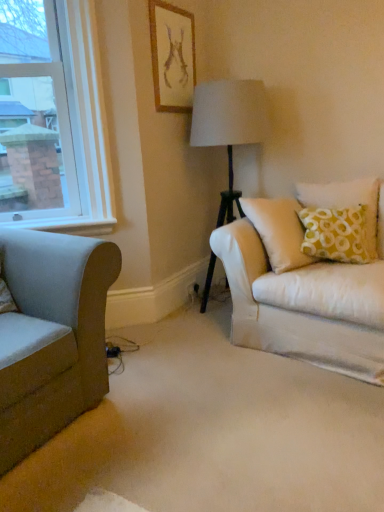
The width and height of the screenshot is (384, 512). What do you see at coordinates (213, 431) in the screenshot? I see `beige fabric carpet at center` at bounding box center [213, 431].

Find the location of `beige fabric carpet at center`. beige fabric carpet at center is located at coordinates (213, 431).

What is the approximate width of velvet green couch at left?

velvet green couch at left is 99.92 centimeters in width.

At what (x,y) coordinates should I click in order to perform the action: click on velvet green couch at left. Please return your answer as a coordinate pair (x, y). This screenshot has width=384, height=512. Looking at the image, I should click on (51, 335).

What do you see at coordinates (52, 119) in the screenshot?
I see `white glass window at upper left` at bounding box center [52, 119].

Measure the distance between white glass window at upper left and camera.

They are 2.25 meters apart.

This screenshot has height=512, width=384. Describe the element at coordinates (172, 57) in the screenshot. I see `matte gold picture frame at upper center` at that location.

This screenshot has width=384, height=512. Describe the element at coordinates (348, 203) in the screenshot. I see `yellow printed fabric pillow at right` at that location.

You are a GUI agent. You are given a task and a screenshot of the screen. Output one action in this format:
    pyautogui.click(x=<x>, y=<y>)
    Task: Click on the beige fabric carpet at center
    The image size is (384, 512).
    Given the screenshot: What is the action you would take?
    pyautogui.click(x=213, y=431)

Where is `window above the yellow printed fabric pillow at right (from the image's perspective)`? This screenshot has height=512, width=384. window above the yellow printed fabric pillow at right (from the image's perspective) is located at coordinates (52, 119).

In terms of height, does yellow printed fabric pillow at right look taller or shorter compared to white glass window at upper left?

Considering their sizes, yellow printed fabric pillow at right has less height than white glass window at upper left.

From a real-world perspective, does yellow printed fabric pillow at right stand above white glass window at upper left?

No, from a real-world perspective, yellow printed fabric pillow at right is not over white glass window at upper left

Is yellow printed fabric pillow at right smaller than white glass window at upper left?

Indeed, yellow printed fabric pillow at right has a smaller size compared to white glass window at upper left.

Does yellow printed fabric pillow at right have a greater height compared to velvet green couch at left?

In fact, yellow printed fabric pillow at right may be shorter than velvet green couch at left.

Based on the photo, is yellow printed fabric pillow at right aimed at velvet green couch at left?

No, yellow printed fabric pillow at right is not facing towards velvet green couch at left.

Does point (369, 249) appear closer or farther from the camera than point (74, 314)?

Point (369, 249) is farther from the camera than point (74, 314).

Does yellow printed fabric pillow at right touch velvet green couch at left?

No, yellow printed fabric pillow at right is not next to velvet green couch at left.

Considering the sizes of objects white glass window at upper left and velvet green couch at left in the image provided, who is shorter, white glass window at upper left or velvet green couch at left?

velvet green couch at left is shorter.

From a real-world perspective, between white glass window at upper left and velvet green couch at left, who is vertically higher?

white glass window at upper left.

Is white glass window at upper left positioned far away from velvet green couch at left?

white glass window at upper left is actually quite close to velvet green couch at left.

Who is more distant, white glass window at upper left or velvet green couch at left?

white glass window at upper left is more distant.

Does yellow printed fabric pillow at right appear on the right side of matte gold picture frame at upper center?

Correct, you'll find yellow printed fabric pillow at right to the right of matte gold picture frame at upper center.

What's the angular difference between yellow printed fabric pillow at right and matte gold picture frame at upper center's facing directions?

The angle between the facing direction of yellow printed fabric pillow at right and the facing direction of matte gold picture frame at upper center is 50.3 degrees.

Who is smaller, yellow printed fabric pillow at right or matte gold picture frame at upper center?

matte gold picture frame at upper center is smaller.

The width and height of the screenshot is (384, 512). I want to click on pillow that appears on the right of matte gold picture frame at upper center, so click(x=348, y=203).

Is white glass window at upper left taller than beige fabric carpet at center?

Yes.

Find the location of a particular element. Image resolution: width=384 pixels, height=512 pixels. plain in front of the white glass window at upper left is located at coordinates pyautogui.click(x=213, y=431).

Would you say white glass window at upper left contains beige fabric carpet at center?

That's incorrect, beige fabric carpet at center is not inside white glass window at upper left.

Does white glass window at upper left have a greater height compared to yellow printed fabric pillow at right?

A: Indeed, white glass window at upper left has a greater height compared to yellow printed fabric pillow at right.

Can you confirm if white glass window at upper left is wider than yellow printed fabric pillow at right?

No, white glass window at upper left is not wider than yellow printed fabric pillow at right.

From a real-world perspective, relative to yellow printed fabric pillow at right, is white glass window at upper left vertically above or below?

From a real-world perspective, white glass window at upper left is physically above yellow printed fabric pillow at right.

Would you say white glass window at upper left contains yellow printed fabric pillow at right?

No, yellow printed fabric pillow at right is not inside white glass window at upper left.

From the image's perspective, is matte gold picture frame at upper center on top of white glass window at upper left?

Yes.

Are matte gold picture frame at upper center and white glass window at upper left beside each other?

No, matte gold picture frame at upper center is not next to white glass window at upper left.

Which of these two, matte gold picture frame at upper center or white glass window at upper left, is thinner?

Thinner between the two is matte gold picture frame at upper center.

How many degrees apart are the facing directions of matte gold picture frame at upper center and white glass window at upper left?

45.7 degrees.

I want to click on pillow located underneath the white glass window at upper left (from a real-world perspective), so click(x=348, y=203).

Locate an element on the screen. The height and width of the screenshot is (512, 384). studio couch below the yellow printed fabric pillow at right (from the image's perspective) is located at coordinates [51, 335].

From the picture: Estimate the real-world distances between objects in this image. Which object is closer to matte gold picture frame at upper center, velvet green couch at left or beige fabric carpet at center?

velvet green couch at left is positioned closer to the anchor matte gold picture frame at upper center.

Estimate the real-world distances between objects in this image. Which object is further from matte gold picture frame at upper center, beige fabric carpet at center or yellow printed fabric pillow at right?

beige fabric carpet at center is further to matte gold picture frame at upper center.

Based on their spatial positions, is beige fabric carpet at center or white glass window at upper left closer to matte gold picture frame at upper center?

white glass window at upper left is positioned closer to the anchor matte gold picture frame at upper center.

Looking at the image, which one is located closer to matte gold picture frame at upper center, yellow printed fabric pillow at right or beige fabric carpet at center?

yellow printed fabric pillow at right lies closer to matte gold picture frame at upper center than the other object.

Looking at the image, which one is located closer to beige fabric carpet at center, matte gold picture frame at upper center or yellow printed fabric pillow at right?

Among the two, yellow printed fabric pillow at right is located nearer to beige fabric carpet at center.

Which object lies further to the anchor point velvet green couch at left, beige fabric carpet at center or white glass window at upper left?

white glass window at upper left is positioned further to the anchor velvet green couch at left.

Based on their spatial positions, is velvet green couch at left or matte gold picture frame at upper center closer to yellow printed fabric pillow at right?

matte gold picture frame at upper center.

Estimate the real-world distances between objects in this image. Which object is further from beige fabric carpet at center, white glass window at upper left or matte gold picture frame at upper center?

The object further to beige fabric carpet at center is matte gold picture frame at upper center.

This screenshot has width=384, height=512. Identify the location of picture frame between velvet green couch at left and yellow printed fabric pillow at right from left to right. (172, 57).

This screenshot has width=384, height=512. Identify the location of window between matte gold picture frame at upper center and beige fabric carpet at center vertically. (52, 119).

Where is `pillow that lies between matte gold picture frame at upper center and beige fabric carpet at center from top to bottom`? Image resolution: width=384 pixels, height=512 pixels. pillow that lies between matte gold picture frame at upper center and beige fabric carpet at center from top to bottom is located at coordinates (348, 203).

What are the coordinates of `picture frame situated between white glass window at upper left and yellow printed fabric pillow at right from left to right` in the screenshot? It's located at (172, 57).